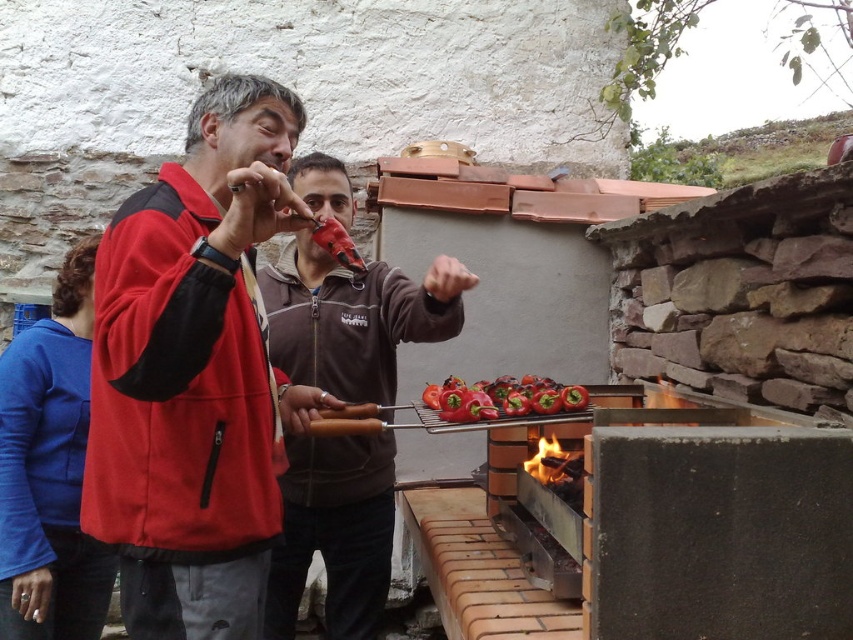
Does point (332, 477) come behind point (543, 390)?

Yes.

Between brown zip-up jacket at center and red glossy bell peppers at center, which one is positioned higher?

red glossy bell peppers at center is higher up.

Between point (415, 300) and point (473, 408), which one is positioned behind?

The point (415, 300) is behind.

This screenshot has width=853, height=640. I want to click on brown zip-up jacket at center, so click(x=354, y=317).

Can you confirm if red glossy bell peppers at center is taller than charcoal black wood at center?

Incorrect, red glossy bell peppers at center's height is not larger of charcoal black wood at center's.

Who is more forward, (463, 422) or (560, 444)?

Point (463, 422) is more forward.

Find the location of a particular element. The width and height of the screenshot is (853, 640). red glossy bell peppers at center is located at coordinates (503, 397).

Who is positioned more to the right, red fleece jacket at center or brown zip-up jacket at center?

brown zip-up jacket at center

Can you confirm if red fleece jacket at center is bigger than brown zip-up jacket at center?

No.

Between point (207, 502) and point (383, 372), which one is positioned in front?

Point (207, 502)

In order to click on red fleece jacket at center in this screenshot , I will do `click(195, 372)`.